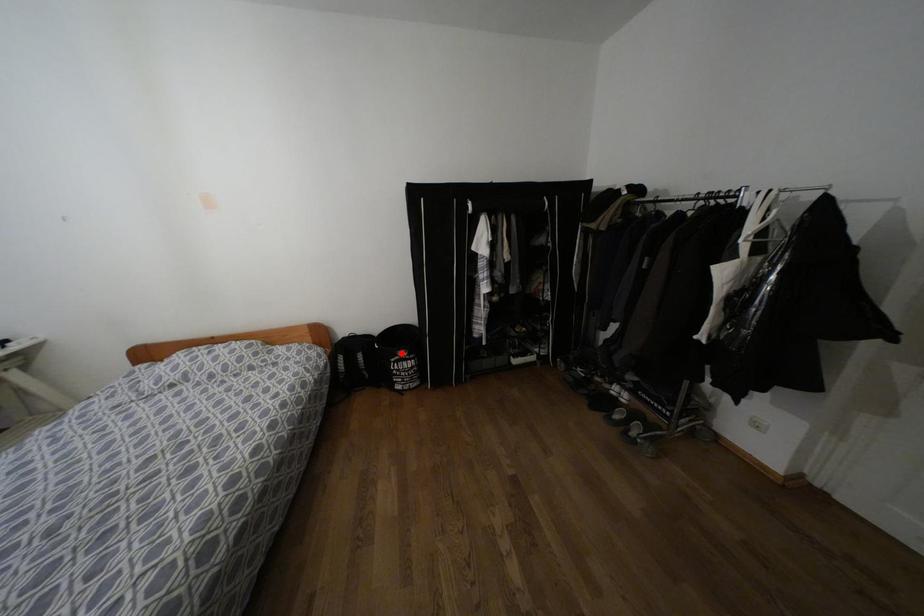
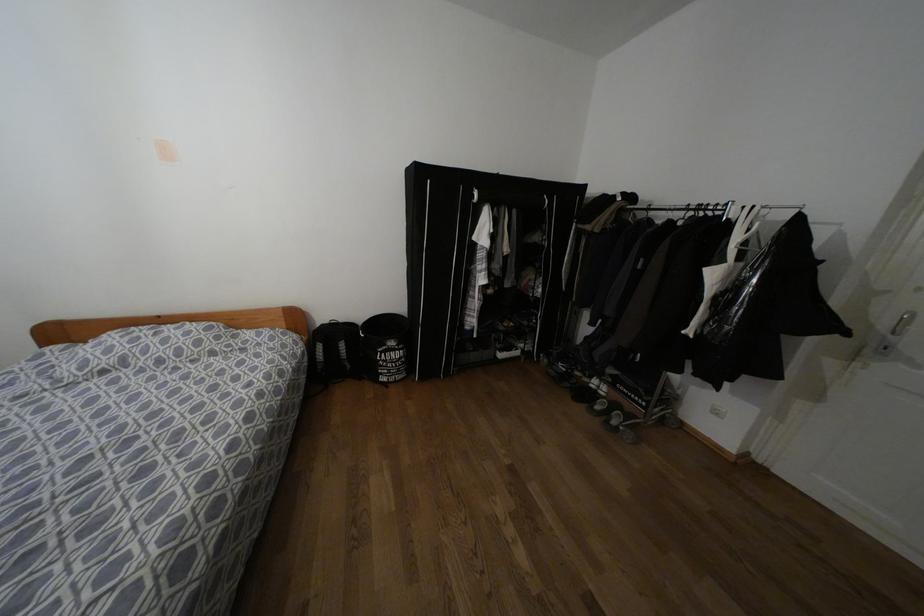
The point at the highlighted location is marked in the first image. Where is the corresponding point in the second image?

(391, 342)